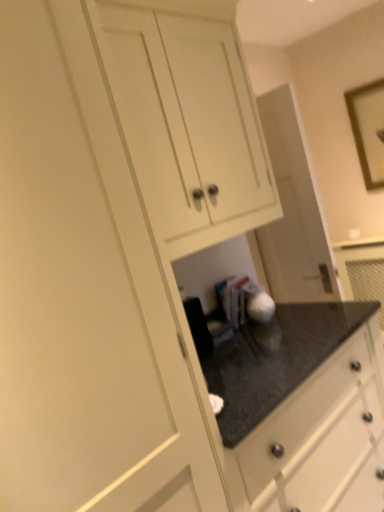
Question: From a real-world perspective, is wooden framed picture at upper right above or below white matte cabinet at upper center?

Choices:
 (A) below
 (B) above

Answer: (A)

Question: From the image's perspective, relative to white matte cabinet at upper center, is wooden framed picture at upper right above or below?

Choices:
 (A) above
 (B) below

Answer: (A)

Question: Looking at the image, does wooden framed picture at upper right seem bigger or smaller compared to white matte cabinet at upper center?

Choices:
 (A) small
 (B) big

Answer: (A)

Question: Considering the positions of white matte cabinet at upper center and wooden framed picture at upper right in the image, is white matte cabinet at upper center taller or shorter than wooden framed picture at upper right?

Choices:
 (A) short
 (B) tall

Answer: (B)

Question: Is white matte cabinet at upper center inside the boundaries of wooden framed picture at upper right, or outside?

Choices:
 (A) inside
 (B) outside

Answer: (B)

Question: Considering their positions, is white matte cabinet at upper center located in front of or behind wooden framed picture at upper right?

Choices:
 (A) behind
 (B) front

Answer: (B)

Question: From the image's perspective, is white matte cabinet at upper center above or below wooden framed picture at upper right?

Choices:
 (A) above
 (B) below

Answer: (B)